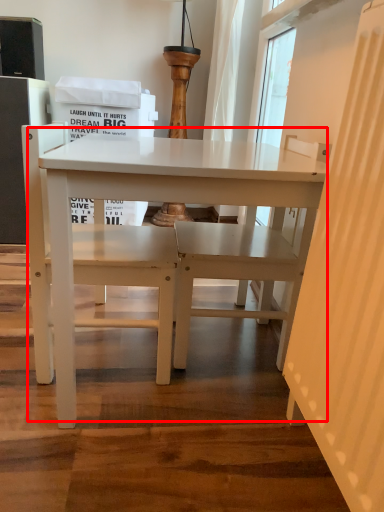
Question: From the image, what is the correct spatial relationship of table (annotated by the red box) in relation to chair?

Choices:
 (A) left
 (B) right

Answer: (B)